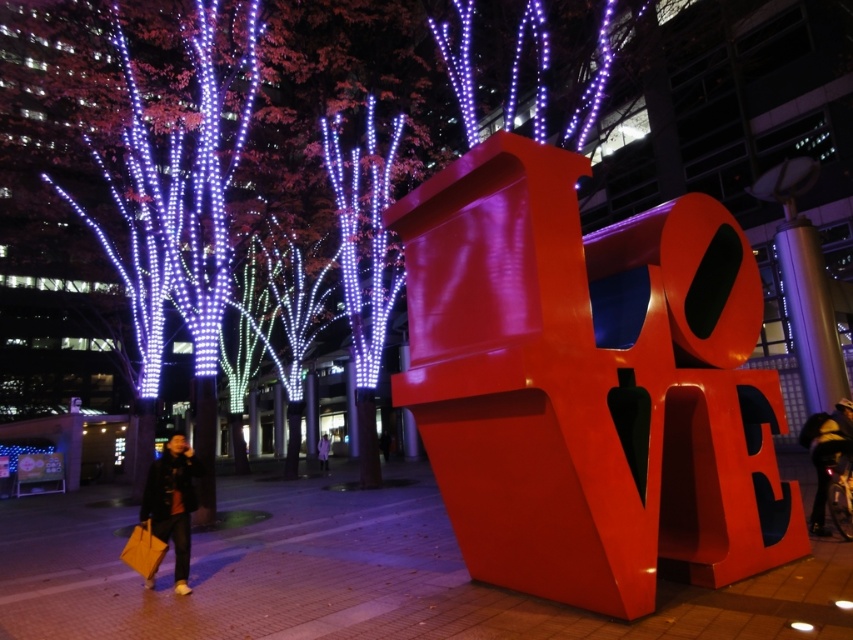
Does dark brown leather jacket at lower left appear under purple fabric coat at lower left?

Actually, dark brown leather jacket at lower left is above purple fabric coat at lower left.

Between dark brown leather jacket at lower left and purple fabric coat at lower left, which one appears on the left side from the viewer's perspective?

From the viewer's perspective, purple fabric coat at lower left appears more on the left side.

Identify the location of dark brown leather jacket at lower left. This screenshot has height=640, width=853. (172, 502).

Locate an element on the screen. This screenshot has width=853, height=640. dark brown leather jacket at lower left is located at coordinates (172, 502).

Which is more to the left, dark brown leather jacket at lower left or dark blue leather jacket at lower right?

Positioned to the left is dark brown leather jacket at lower left.

Between dark brown leather jacket at lower left and dark blue leather jacket at lower right, which one is positioned lower?

dark brown leather jacket at lower left is lower down.

Where is `dark brown leather jacket at lower left`? The height and width of the screenshot is (640, 853). dark brown leather jacket at lower left is located at coordinates (172, 502).

Is dark blue leather jacket at lower right taller than purple fabric coat at lower left?

Yes.

Does dark blue leather jacket at lower right appear on the left side of purple fabric coat at lower left?

In fact, dark blue leather jacket at lower right is to the right of purple fabric coat at lower left.

Identify the location of dark blue leather jacket at lower right. This screenshot has height=640, width=853. (827, 452).